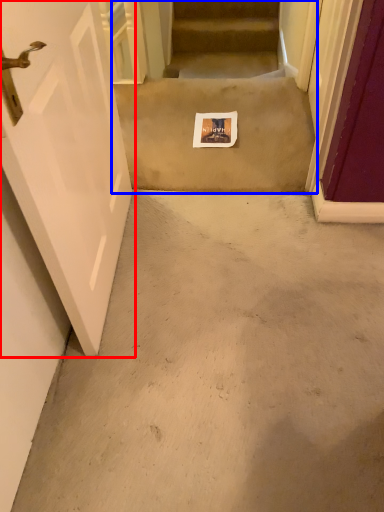
Question: Among these objects, which one is nearest to the camera, door (highlighted by a red box) or escalator (highlighted by a blue box)?

Choices:
 (A) door
 (B) escalator

Answer: (A)